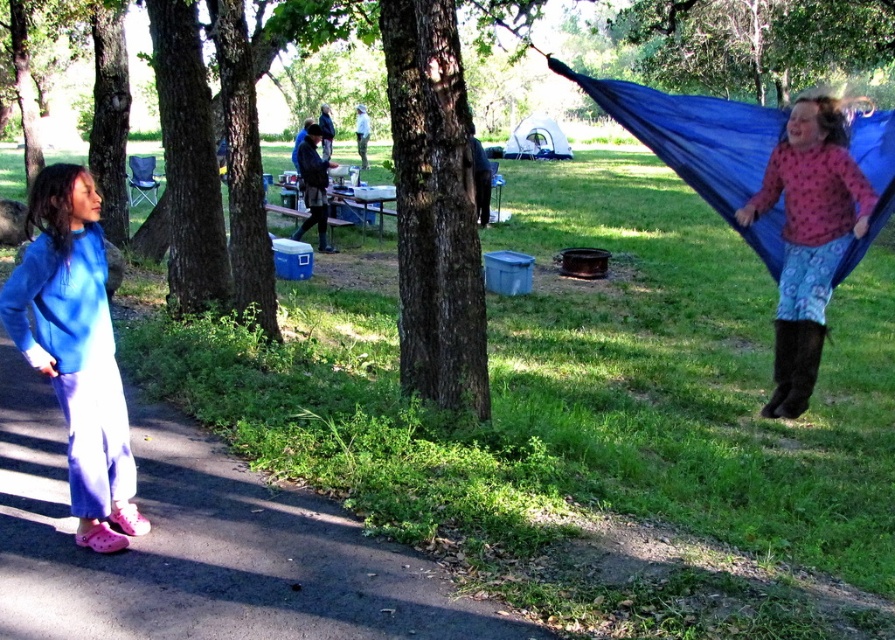
Based on the photo, does dark brown bark tree at center have a larger size compared to blue fleece sweatshirt at left?

Correct, dark brown bark tree at center is larger in size than blue fleece sweatshirt at left.

Is point (414, 385) farther from camera compared to point (126, 424)?

Yes, it is behind point (126, 424).

Where is `dark brown bark tree at center`? This screenshot has width=895, height=640. dark brown bark tree at center is located at coordinates (433, 209).

Can you confirm if dark brown bark tree at center is taller than blue fabric hammock at right?

In fact, dark brown bark tree at center may be shorter than blue fabric hammock at right.

Is dark brown bark tree at center further to the viewer compared to blue fabric hammock at right?

No, it is in front of blue fabric hammock at right.

Image resolution: width=895 pixels, height=640 pixels. What do you see at coordinates (433, 209) in the screenshot?
I see `dark brown bark tree at center` at bounding box center [433, 209].

The image size is (895, 640). Find the location of `dark brown bark tree at center`. dark brown bark tree at center is located at coordinates (433, 209).

Can you confirm if pink rubber shoes at lower left is shorter than blue fabric hammock at right?

Correct, pink rubber shoes at lower left is not as tall as blue fabric hammock at right.

Does pink rubber shoes at lower left appear under blue fabric hammock at right?

Yes, pink rubber shoes at lower left is below blue fabric hammock at right.

Locate an element on the screen. The height and width of the screenshot is (640, 895). pink rubber shoes at lower left is located at coordinates (201, 547).